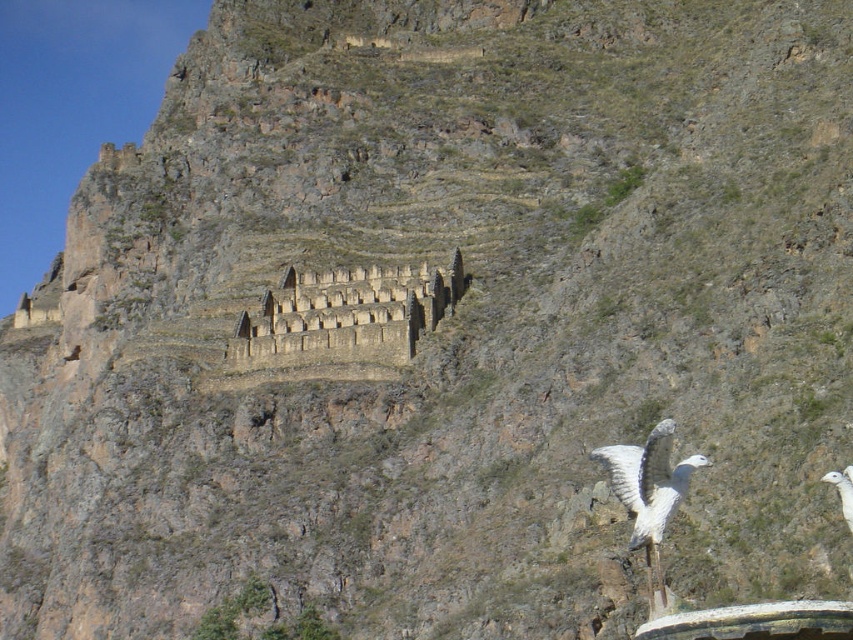
You are a hiker standing at the base of the mountain looking up. You notice two points marked on the mountain face. The first point is at coordinate point (624, 467) and the second is at point (842, 481). Which point is closer to you?

Point (842, 481) is closer to you because it is in front of point (624, 467).